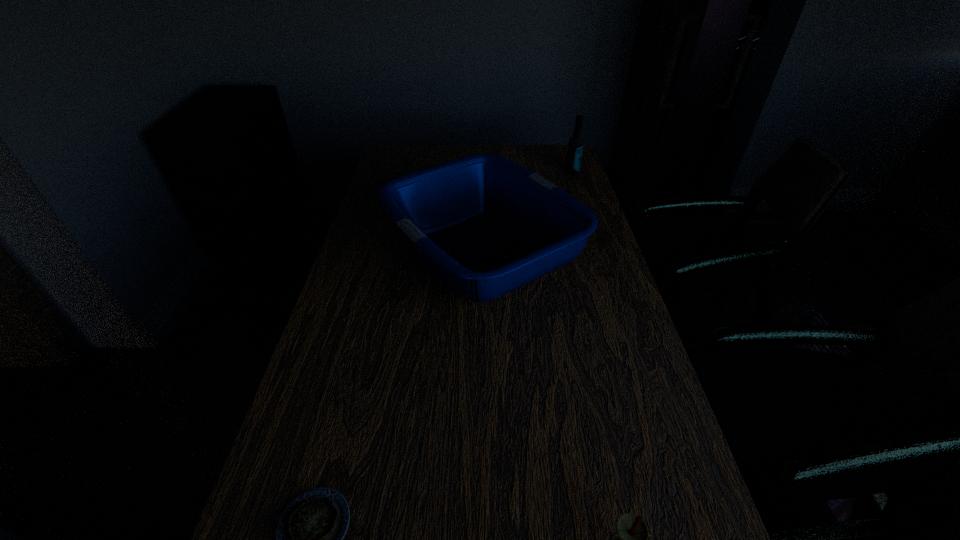
The height and width of the screenshot is (540, 960). I want to click on object positioned at the far right corner, so click(x=575, y=147).

The width and height of the screenshot is (960, 540). What are the coordinates of `blank space at the far edge of the desktop` in the screenshot? It's located at (450, 145).

This screenshot has height=540, width=960. In the image, there is a desktop. What are the coordinates of `free region at the left edge` in the screenshot? It's located at (256, 521).

The height and width of the screenshot is (540, 960). Identify the location of vacant space at the right edge. (622, 413).

The width and height of the screenshot is (960, 540). In order to click on vacant space at the far left corner of the desktop in this screenshot , I will do `click(425, 147)`.

Locate an element on the screen. This screenshot has height=540, width=960. object that is the closest one to the candle is located at coordinates (x=309, y=539).

Select which object is the third closest to the quiche. Please provide its 2D coordinates. Your answer should be formatted as a tuple, i.e. [(x, y)], where the tuple contains the x and y coordinates of a point satisfying the conditions above.

[(575, 147)]